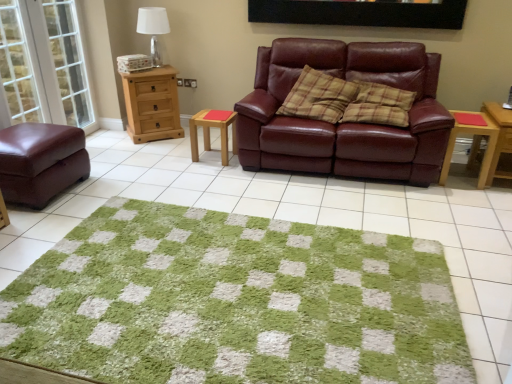
I want to click on free spot below wooden side table at right, the second table from the left (from a real-world perspective), so click(459, 174).